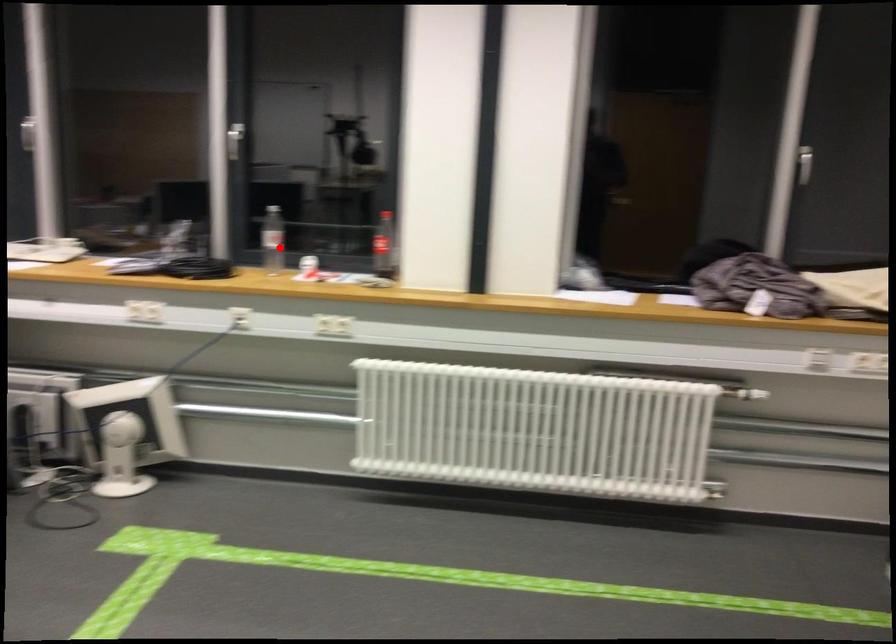
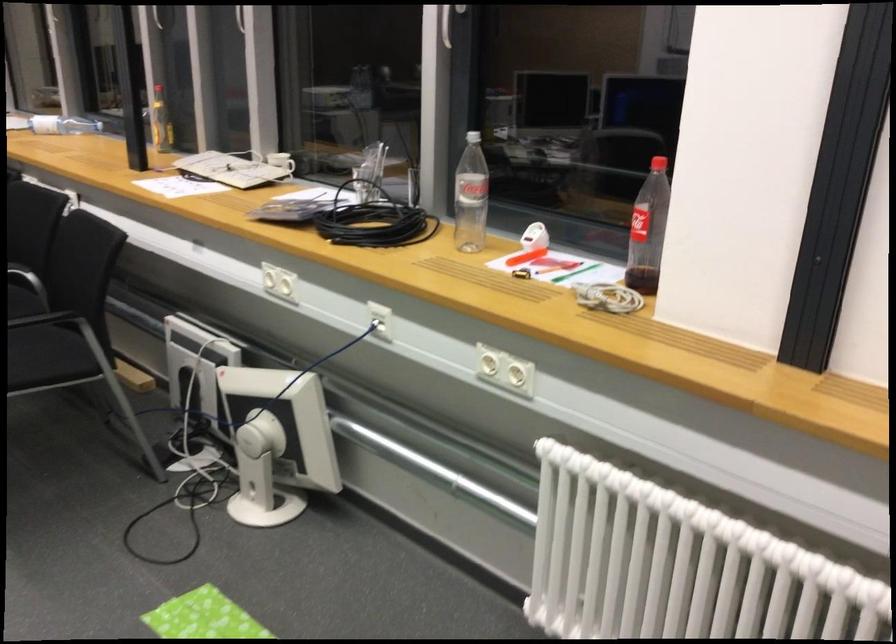
Question: I am providing you with two images of the same scene from different viewpoints. Given a red point in image1, look at the same physical point in image2. Is it:

Choices:
 (A) Closer to the viewpoint
 (B) Farther from the viewpoint

Answer: (A)